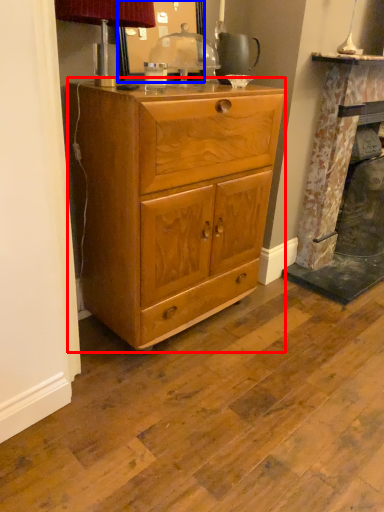
Question: Which object appears farthest to the camera in this image, chest of drawers (highlighted by a red box) or mirror (highlighted by a blue box)?

Choices:
 (A) chest of drawers
 (B) mirror

Answer: (B)